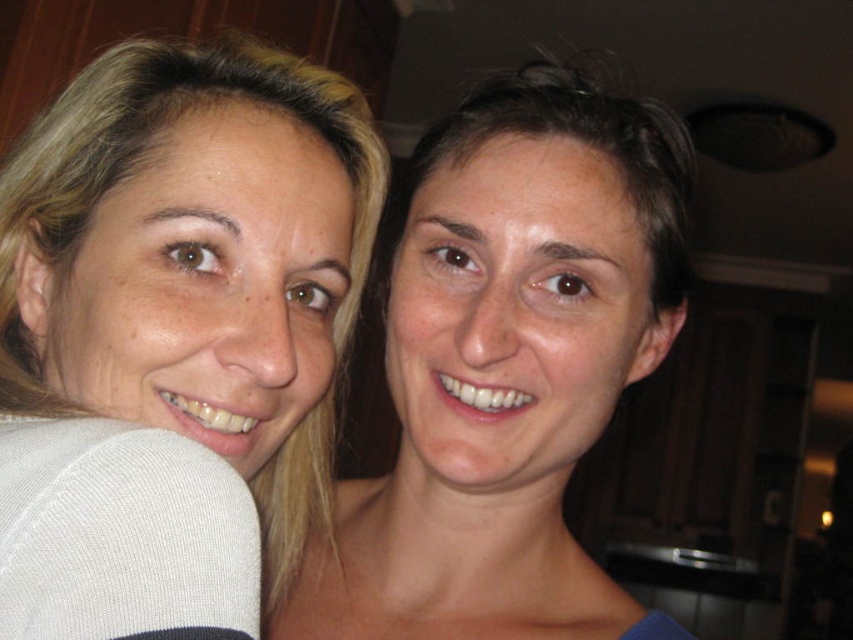
Question: Which of the following is the farthest from the observer?

Choices:
 (A) (283, 532)
 (B) (527, 344)

Answer: (A)

Question: Can you confirm if blonde hair at left is bigger than smooth skin face at center?

Choices:
 (A) no
 (B) yes

Answer: (A)

Question: Is blonde hair at left bigger than smooth skin face at center?

Choices:
 (A) no
 (B) yes

Answer: (A)

Question: Considering the relative positions of blonde hair at left and smooth skin face at center in the image provided, where is blonde hair at left located with respect to smooth skin face at center?

Choices:
 (A) left
 (B) right

Answer: (A)

Question: Which object appears farthest from the camera in this image?

Choices:
 (A) smooth skin face at center
 (B) blonde hair at left

Answer: (A)